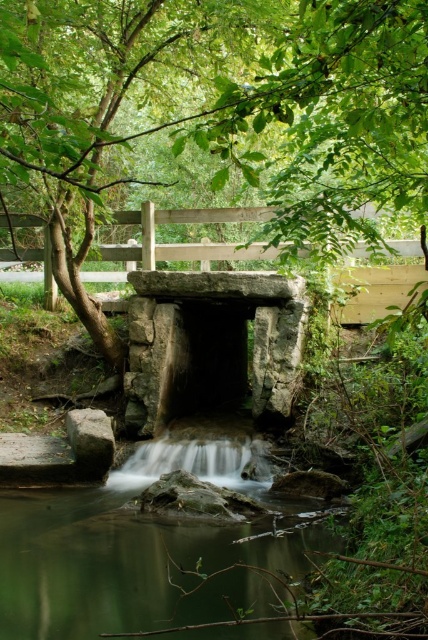
Does green leafy tree at center have a larger size compared to green translucent water at center?

Yes, green leafy tree at center is bigger than green translucent water at center.

Is point (318, 26) farther from camera compared to point (32, 598)?

No, it is in front of (32, 598).

Locate an element on the screen. This screenshot has height=640, width=428. green leafy tree at center is located at coordinates pyautogui.click(x=293, y=122).

What are the coordinates of `green leafy tree at center` in the screenshot? It's located at (293, 122).

Between green leafy tree at center and smooth gray stone waterfall at center, which one appears on the right side from the viewer's perspective?

smooth gray stone waterfall at center is more to the right.

Which of these two, green leafy tree at center or smooth gray stone waterfall at center, stands taller?

green leafy tree at center is taller.

Measure the distance between green leafy tree at center and camera.

green leafy tree at center and camera are 4.14 feet apart.

Identify the location of green leafy tree at center. The height and width of the screenshot is (640, 428). pyautogui.click(x=293, y=122).

From the picture: Which of these two, green translucent water at center or smooth gray stone waterfall at center, stands shorter?

smooth gray stone waterfall at center is shorter.

Does green translucent water at center appear over smooth gray stone waterfall at center?

No, green translucent water at center is not above smooth gray stone waterfall at center.

Which is in front, point (95, 611) or point (243, 472)?

Point (95, 611) is more forward.

Where is `green translucent water at center`? green translucent water at center is located at coordinates (127, 564).